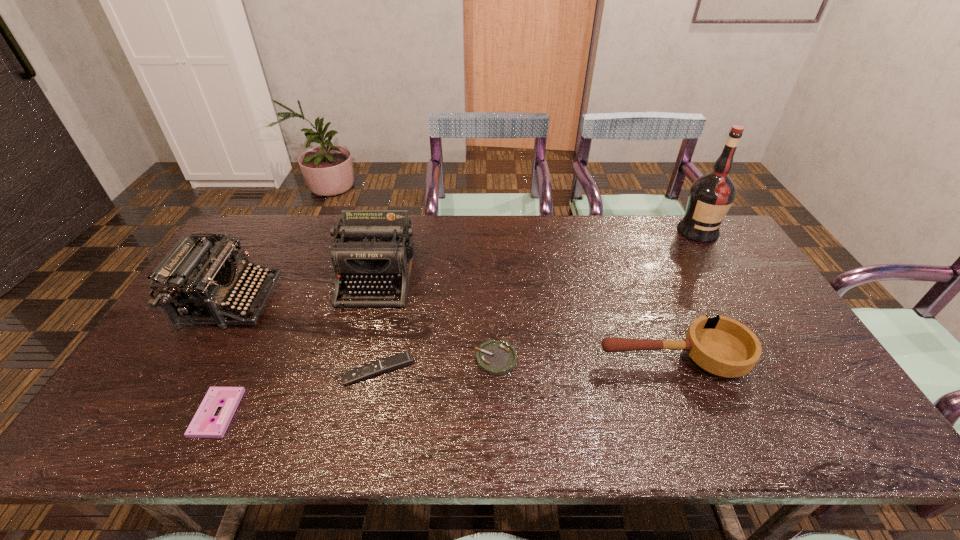
The image size is (960, 540). In the image, there is a desktop. In order to click on vacant area at the near right corner in this screenshot , I will do (839, 441).

Where is `free spot between the right typewriter and the shortest object`? This screenshot has height=540, width=960. free spot between the right typewriter and the shortest object is located at coordinates (298, 345).

This screenshot has width=960, height=540. In order to click on free space between the right typewriter and the sixth object from left to right in this screenshot , I will do `click(524, 318)`.

The height and width of the screenshot is (540, 960). Identify the location of free space between the farthest object and the fourth shortest object. (685, 295).

In order to click on blank region between the sixth object from left to right and the fifth object from left to right in this screenshot , I will do `click(584, 359)`.

Where is `free spot between the ashtray and the left typewriter`? free spot between the ashtray and the left typewriter is located at coordinates (364, 330).

In order to click on unoccupied position between the remote control and the videotape in this screenshot , I will do `click(298, 392)`.

I want to click on free area in between the left typewriter and the farthest object, so click(465, 266).

Find the location of a particular element. vacant point located between the fourth tallest object and the right typewriter is located at coordinates (524, 318).

I want to click on vacant area that lies between the right typewriter and the farthest object, so click(x=538, y=254).